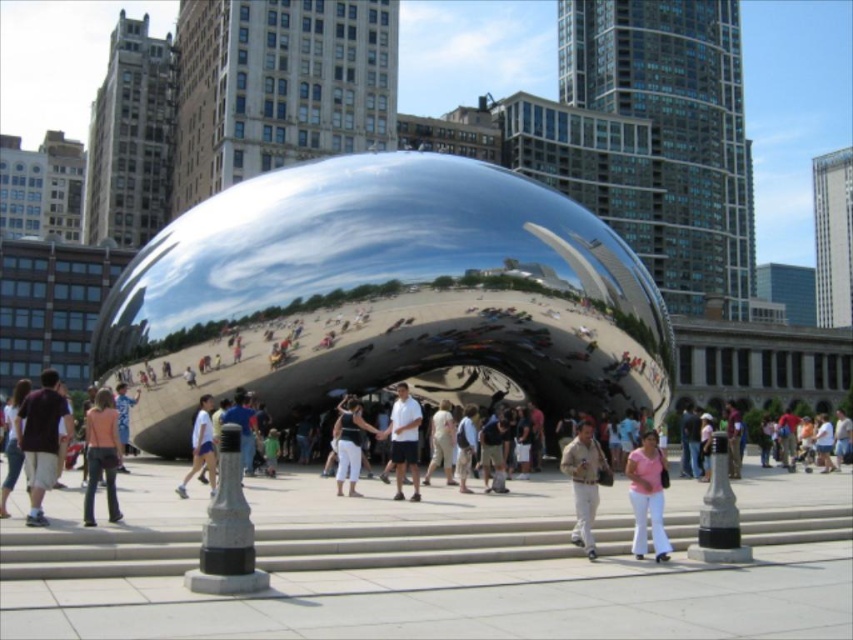
Which is behind, point (91, 499) or point (335, 444)?

The point (335, 444) is behind.

Does point (91, 476) come behind point (347, 435)?

No, it is not.

Is point (107, 406) positioned before point (374, 426)?

Yes, it is in front of point (374, 426).

The width and height of the screenshot is (853, 640). I want to click on matte pink shirt at center, so coord(102,454).

Does khaki cotton pants at center appear on the left side of white cotton pants at center?

No, khaki cotton pants at center is not to the left of white cotton pants at center.

Which is in front, point (585, 500) or point (338, 476)?

Point (585, 500)

Does point (590, 532) come in front of point (368, 428)?

That is True.

Find the location of a particular element. This screenshot has height=640, width=853. khaki cotton pants at center is located at coordinates (584, 483).

In the scene shown: Between pink fabric pants at center and matte pink shirt at center, which one is positioned lower?

matte pink shirt at center is below.

Does pink fabric pants at center have a greater width compared to matte pink shirt at center?

In fact, pink fabric pants at center might be narrower than matte pink shirt at center.

Find the location of a particular element. This screenshot has height=640, width=853. pink fabric pants at center is located at coordinates (647, 496).

The image size is (853, 640). In order to click on pink fabric pants at center in this screenshot , I will do `click(647, 496)`.